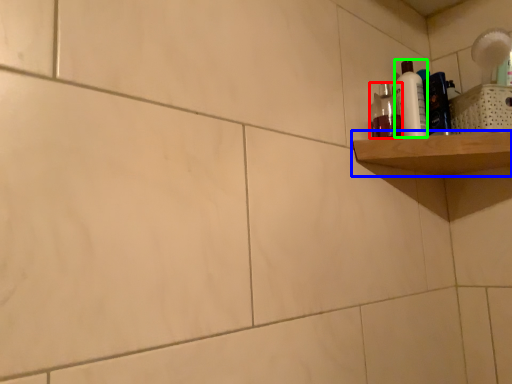
Question: Considering the real-world distances, which object is farthest from mouthwash (highlighted by a red box)? shelf (highlighted by a blue box) or cleaning product (highlighted by a green box)?

Choices:
 (A) shelf
 (B) cleaning product

Answer: (A)